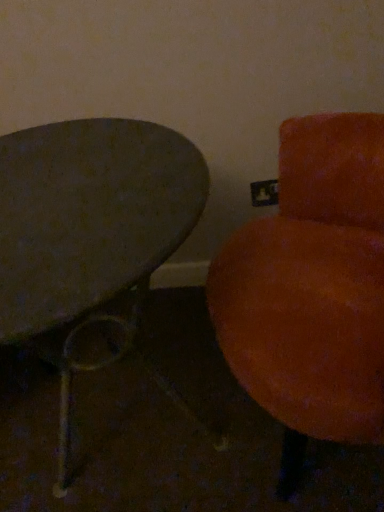
Question: Considering the positions of metallic gray table at left and velvet orange chair at right in the image, is metallic gray table at left wider or thinner than velvet orange chair at right?

Choices:
 (A) wide
 (B) thin

Answer: (A)

Question: Is metallic gray table at left spatially inside velvet orange chair at right, or outside of it?

Choices:
 (A) inside
 (B) outside

Answer: (B)

Question: In the image, is metallic gray table at left on the left side or the right side of velvet orange chair at right?

Choices:
 (A) left
 (B) right

Answer: (A)

Question: Looking at the image, does velvet orange chair at right seem bigger or smaller compared to metallic gray table at left?

Choices:
 (A) small
 (B) big

Answer: (B)

Question: Do you think velvet orange chair at right is within metallic gray table at left, or outside of it?

Choices:
 (A) inside
 (B) outside

Answer: (B)

Question: Looking at their shapes, would you say velvet orange chair at right is wider or thinner than metallic gray table at left?

Choices:
 (A) thin
 (B) wide

Answer: (A)

Question: From the image's perspective, relative to metallic gray table at left, is velvet orange chair at right above or below?

Choices:
 (A) above
 (B) below

Answer: (A)